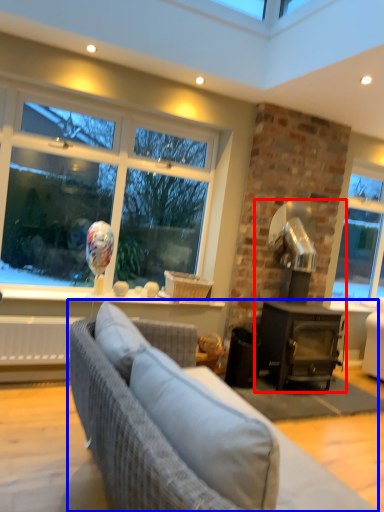
Question: Which object is closer to the camera taking this photo, fireplace (highlighted by a red box) or studio couch (highlighted by a blue box)?

Choices:
 (A) fireplace
 (B) studio couch

Answer: (B)